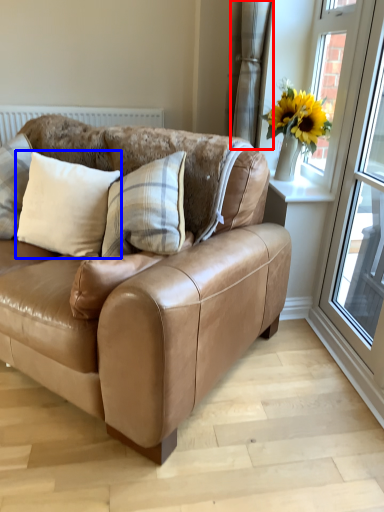
Question: Which point is closer to the camera, curtain (highlighted by a red box) or pillow (highlighted by a blue box)?

Choices:
 (A) curtain
 (B) pillow

Answer: (B)